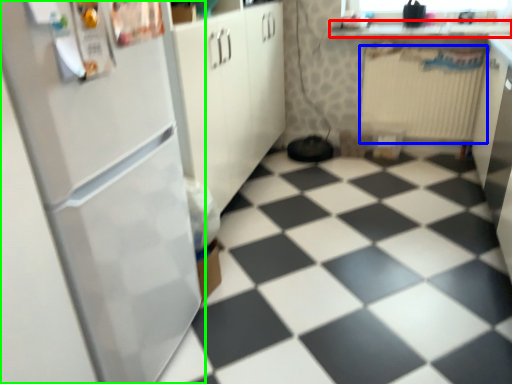
Question: Which is farther away from counter top (highlighted by a red box)? radiator (highlighted by a blue box) or refrigerator (highlighted by a green box)?

Choices:
 (A) radiator
 (B) refrigerator

Answer: (B)